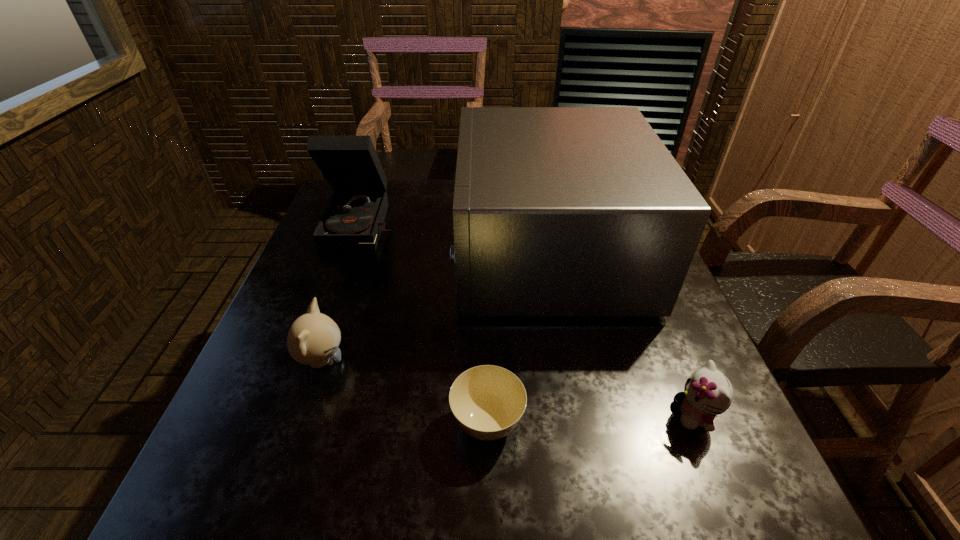
This screenshot has height=540, width=960. Identify the location of microwave oven. (558, 211).

In order to click on phonograph_record in this screenshot , I will do `click(354, 217)`.

You are a GUI agent. You are given a task and a screenshot of the screen. Output one action in this format:
    pyautogui.click(x=<x>, y=<y>)
    Task: Click on the third nearest object
    The height and width of the screenshot is (540, 960).
    Given the screenshot: What is the action you would take?
    pyautogui.click(x=313, y=339)

Locate an element on the screen. the left kitten is located at coordinates coord(313,339).

I want to click on the nearer kitten, so pyautogui.click(x=707, y=392).

Locate an element on the screen. This screenshot has width=960, height=540. the shortest object is located at coordinates (487, 401).

Locate an element on the screen. The height and width of the screenshot is (540, 960). vacant point located 0.080m with the door open on the microwave oven is located at coordinates (426, 252).

Where is `free spot located with the door open on the microwave oven`? This screenshot has width=960, height=540. free spot located with the door open on the microwave oven is located at coordinates (307, 252).

This screenshot has height=540, width=960. I want to click on free space located with the door open on the microwave oven, so click(307, 252).

Find the location of a particular element. This screenshot has width=960, height=540. blank space located 0.090m on the front-facing side of the phonograph_record is located at coordinates (347, 273).